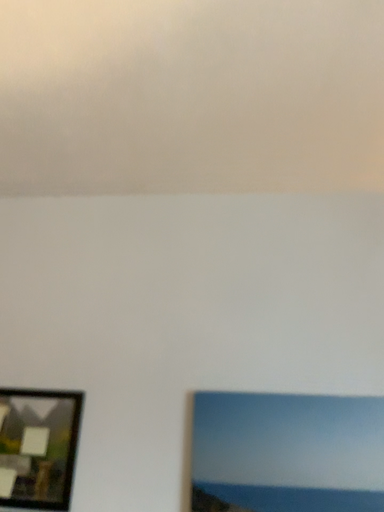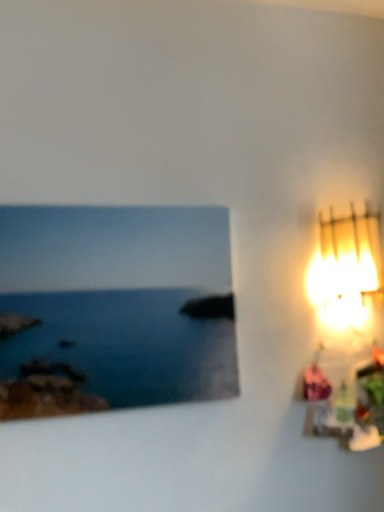
Question: Which way did the camera rotate in the video?

Choices:
 (A) rotated left
 (B) rotated right

Answer: (B)